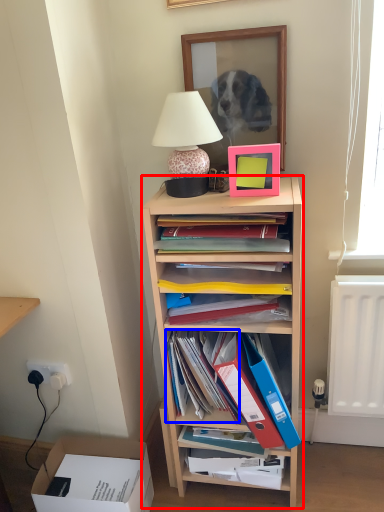
Question: Among these objects, which one is nearest to the camera, shelf (highlighted by a red box) or book (highlighted by a blue box)?

Choices:
 (A) shelf
 (B) book

Answer: (A)